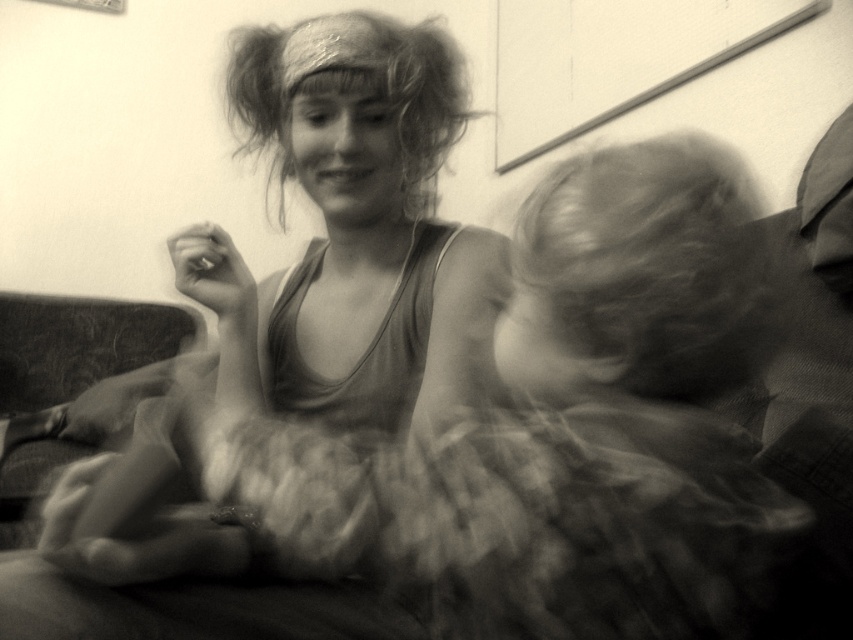
Question: Does smooth fabric dress at center lie behind matte fabric dress at center?

Choices:
 (A) yes
 (B) no

Answer: (B)

Question: Does smooth fabric dress at center come in front of matte fabric dress at center?

Choices:
 (A) no
 (B) yes

Answer: (B)

Question: Estimate the real-world distances between objects in this image. Which object is farther from the curly hair at upper center?

Choices:
 (A) matte fabric dress at center
 (B) blonde fuzzy hair at right
 (C) smooth fabric dress at center

Answer: (B)

Question: Is smooth fabric dress at center thinner than blonde fuzzy hair at right?

Choices:
 (A) no
 (B) yes

Answer: (A)

Question: Estimate the real-world distances between objects in this image. Which object is farther from the blonde fuzzy hair at right?

Choices:
 (A) smooth fabric dress at center
 (B) matte fabric dress at center

Answer: (B)

Question: Which is farther from the smooth fabric dress at center?

Choices:
 (A) blonde fuzzy hair at right
 (B) matte fabric dress at center

Answer: (B)